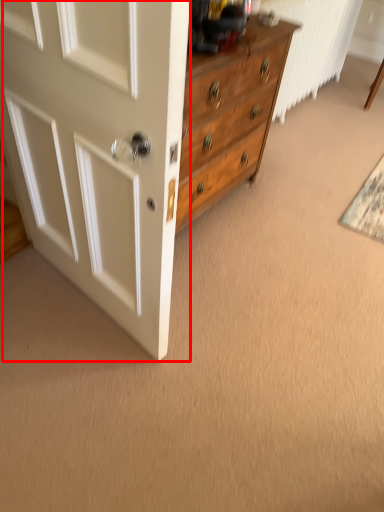
Question: Where is door (annotated by the red box) located in relation to doormat in the image?

Choices:
 (A) right
 (B) left

Answer: (B)